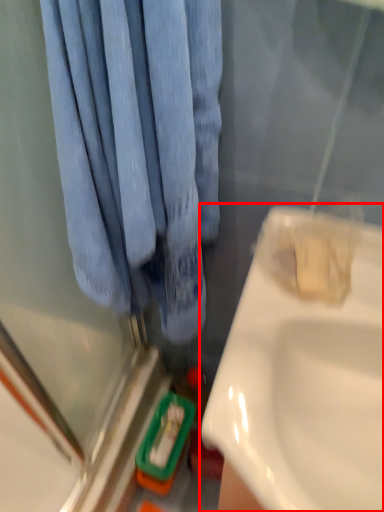
Question: From the image's perspective, what is the correct spatial positioning of sink (annotated by the red box) in reference to curtain?

Choices:
 (A) above
 (B) below

Answer: (B)